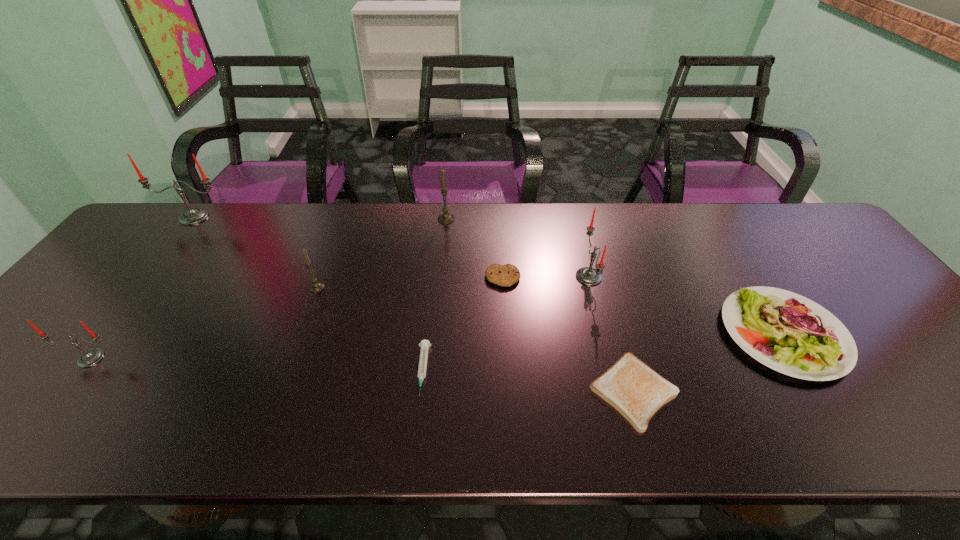
Where is `vacant space at the near edge of the desktop`? This screenshot has height=540, width=960. vacant space at the near edge of the desktop is located at coordinates (168, 433).

Image resolution: width=960 pixels, height=540 pixels. Identify the location of vacant region at the left edge of the desktop. (131, 309).

At what (x,y) coordinates should I click in order to perform the action: click on free space at the right edge. Please return your answer as a coordinate pair (x, y). Looking at the image, I should click on (854, 267).

The height and width of the screenshot is (540, 960). In order to click on blank area at the far left corner in this screenshot , I will do [x=187, y=230].

Where is `vacant area at the far right corner of the desktop`? The image size is (960, 540). vacant area at the far right corner of the desktop is located at coordinates (752, 202).

Find the location of `vacant space that's between the tallest object and the rightmost red candle`. vacant space that's between the tallest object and the rightmost red candle is located at coordinates (392, 247).

Find the location of `free space between the sixth tallest object and the white syringe`. free space between the sixth tallest object and the white syringe is located at coordinates (603, 352).

Find the location of `empty space between the syringe and the rightmost candle`. empty space between the syringe and the rightmost candle is located at coordinates (506, 323).

Locate an element on the screen. This screenshot has width=960, height=540. empty space between the fourth shortest object and the second smallest red candle is located at coordinates (686, 305).

Find the location of a particular element. This screenshot has height=540, width=960. free space between the tallest candle and the left gray candle is located at coordinates (255, 252).